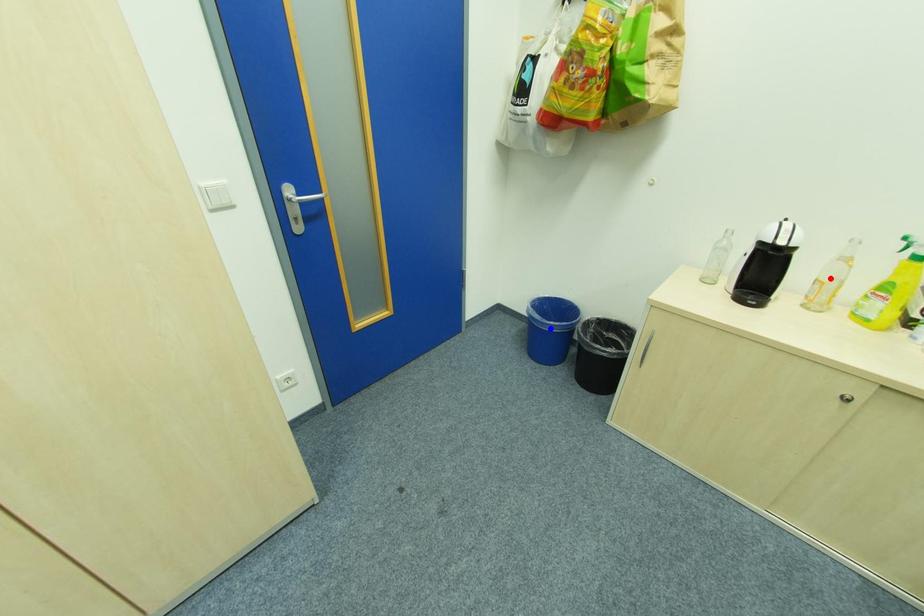
Question: In the image, two points are highlighted. Which point is nearer to the camera? Reply with the corresponding letter.

Choices:
 (A) blue point
 (B) red point

Answer: (B)